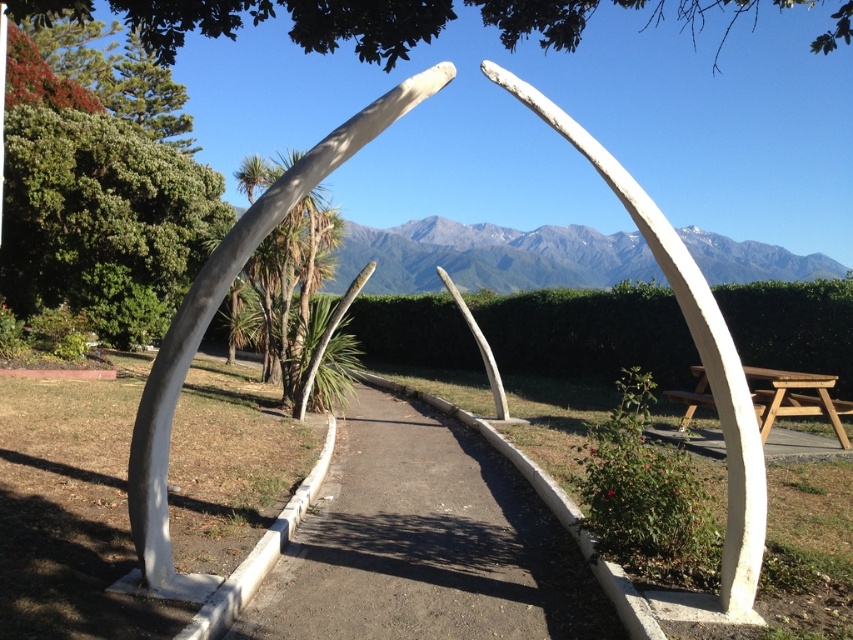
Between white concrete path at center and white matte whalebone at center, which one is positioned higher?

Positioned higher is white matte whalebone at center.

Does white concrete path at center appear under white matte whalebone at center?

Correct, white concrete path at center is located below white matte whalebone at center.

Is point (341, 524) farther from viewer compared to point (160, 513)?

Yes.

Find the location of a particular element. Image resolution: width=853 pixels, height=640 pixels. white concrete path at center is located at coordinates [x=425, y=544].

Can you confirm if white polished bone at center is bigger than wooden picnic table at right?

No, white polished bone at center is not bigger than wooden picnic table at right.

Is white polished bone at center wider than wooden picnic table at right?

No, white polished bone at center is not wider than wooden picnic table at right.

The image size is (853, 640). What do you see at coordinates (695, 348) in the screenshot?
I see `white polished bone at center` at bounding box center [695, 348].

Identify the location of white polished bone at center. Image resolution: width=853 pixels, height=640 pixels. (695, 348).

Does white concrete path at center lie behind white polished bone at center?

Yes, it is.

Between white concrete path at center and white polished bone at center, which one is positioned lower?

white concrete path at center is lower down.

Is point (367, 636) more distant than point (608, 182)?

That is True.

You are a GUI agent. You are given a task and a screenshot of the screen. Output one action in this format:
    pyautogui.click(x=<x>, y=<y>)
    Task: Click on the white concrete path at center
    This screenshot has height=640, width=853.
    Given the screenshot: What is the action you would take?
    pyautogui.click(x=425, y=544)